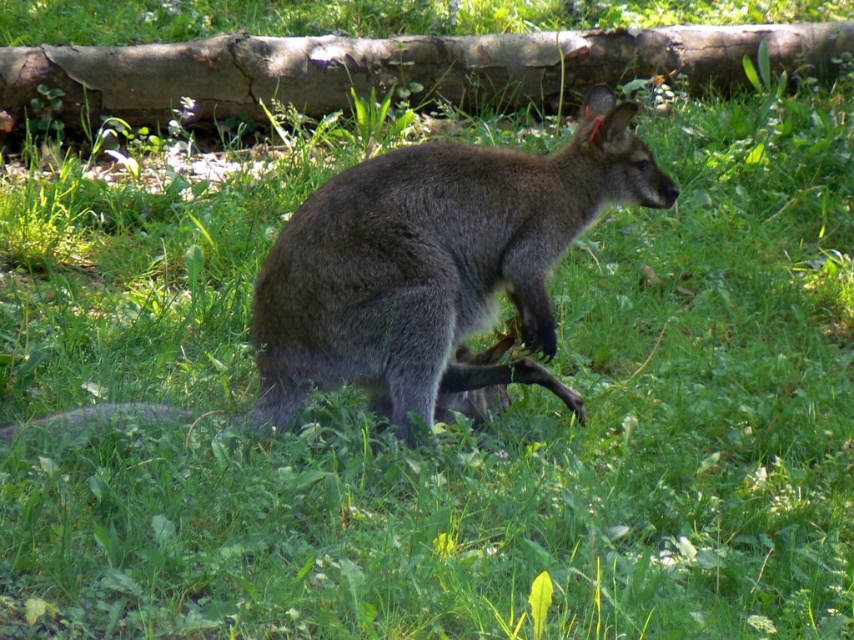
Which is in front, point (565, 164) or point (385, 86)?

Positioned in front is point (565, 164).

Based on the photo, is gray fur kangaroo at center to the left of brown rough log at upper center from the viewer's perspective?

Yes, gray fur kangaroo at center is to the left of brown rough log at upper center.

Measure the distance between gray fur kangaroo at center and camera.

10.42 feet

Where is `gray fur kangaroo at center`? gray fur kangaroo at center is located at coordinates (434, 266).